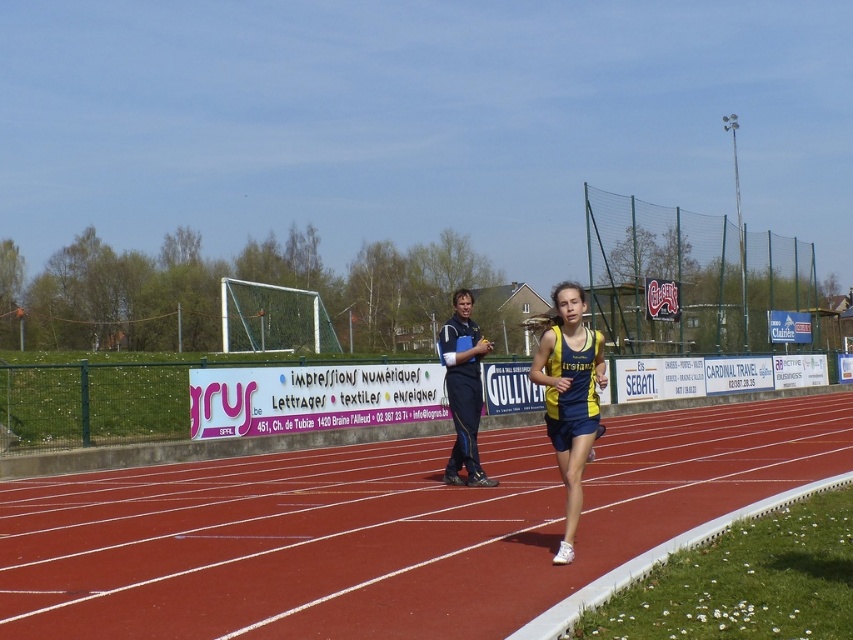
Is the position of rubberized red track at center less distant than that of blue fabric jacket at center?

Yes, rubberized red track at center is in front of blue fabric jacket at center.

Does point (151, 632) come in front of point (450, 380)?

Yes, it is in front of point (450, 380).

At what (x,y) coordinates should I click in order to perform the action: click on rubberized red track at center. Please return your answer as a coordinate pair (x, y). This screenshot has width=853, height=640. Looking at the image, I should click on (381, 529).

You are a GUI agent. You are given a task and a screenshot of the screen. Output one action in this format:
    pyautogui.click(x=<x>, y=<y>)
    Task: Click on the rubberized red track at center
    The height and width of the screenshot is (640, 853).
    Given the screenshot: What is the action you would take?
    pyautogui.click(x=381, y=529)

Does rubberized red track at center lie in front of yellow fabric running suit at center?

Yes, rubberized red track at center is closer to the viewer.

Which is above, rubberized red track at center or yellow fabric running suit at center?

Positioned higher is yellow fabric running suit at center.

Between point (437, 627) and point (560, 472), which one is positioned behind?

Point (560, 472)

Locate an element on the screen. Image resolution: width=853 pixels, height=640 pixels. rubberized red track at center is located at coordinates (381, 529).

Can you confirm if yellow fabric running suit at center is thinner than blue fabric jacket at center?

Incorrect, yellow fabric running suit at center's width is not less than blue fabric jacket at center's.

Between point (558, 454) and point (465, 394), which one is positioned behind?

The point (465, 394) is behind.

This screenshot has width=853, height=640. Find the location of `yellow fabric running suit at center`. yellow fabric running suit at center is located at coordinates (569, 397).